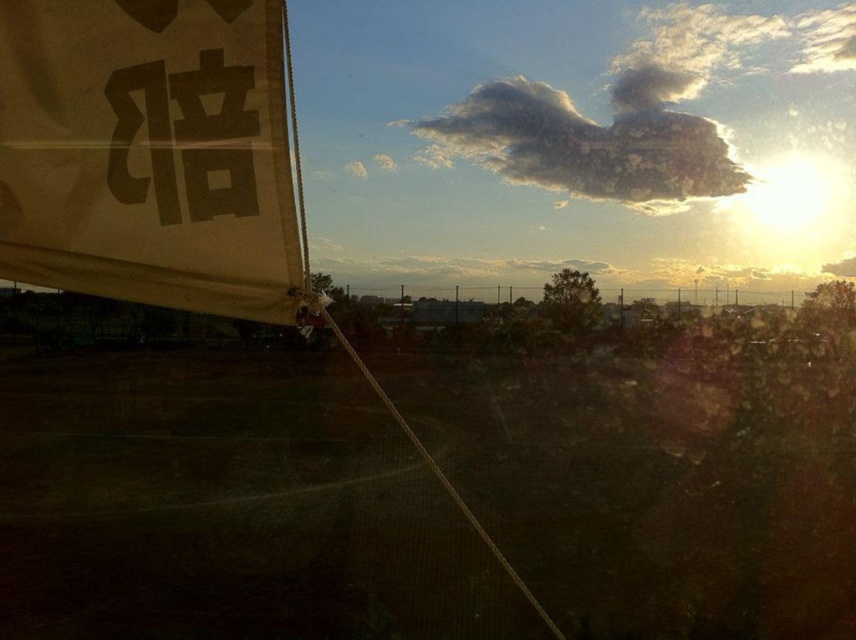
Question: Which of the following is the closest to the observer?

Choices:
 (A) (282, 264)
 (B) (609, 152)

Answer: (A)

Question: Does white fabric sign at upper left appear under white fluffy cloud at upper center?

Choices:
 (A) no
 (B) yes

Answer: (B)

Question: From the image, what is the correct spatial relationship of white fabric sign at upper left in relation to white fluffy cloud at upper center?

Choices:
 (A) right
 (B) left

Answer: (B)

Question: Is white fabric sign at upper left to the left of white fluffy cloud at upper center from the viewer's perspective?

Choices:
 (A) no
 (B) yes

Answer: (B)